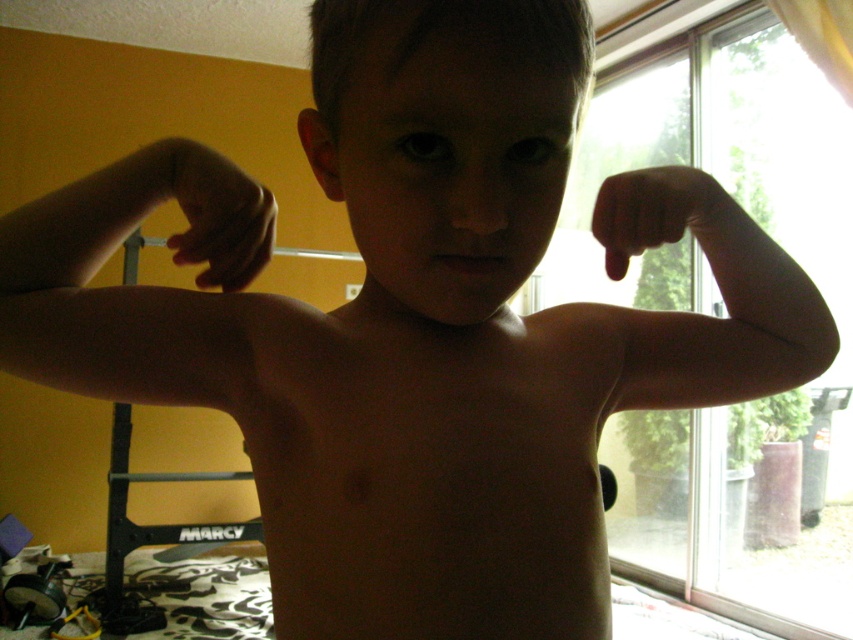
Does skinny flesh at center have a larger size compared to black matte hand at right?

Yes.

This screenshot has width=853, height=640. Identify the location of skinny flesh at center. (431, 467).

Does transparent glass screen door at right lie in front of black matte hand at right?

No, transparent glass screen door at right is behind black matte hand at right.

Can you confirm if transparent glass screen door at right is positioned to the left of black matte hand at right?

No, transparent glass screen door at right is not to the left of black matte hand at right.

The image size is (853, 640). I want to click on transparent glass screen door at right, so click(x=723, y=316).

Can you confirm if matte skin at left is positioned above matte skin hand at upper center?

No.

Is matte skin at left to the left of matte skin hand at upper center from the viewer's perspective?

Correct, you'll find matte skin at left to the left of matte skin hand at upper center.

Which is in front, point (234, 262) or point (241, 172)?

Point (241, 172) is more forward.

Locate an element on the screen. This screenshot has height=640, width=853. matte skin at left is located at coordinates (137, 285).